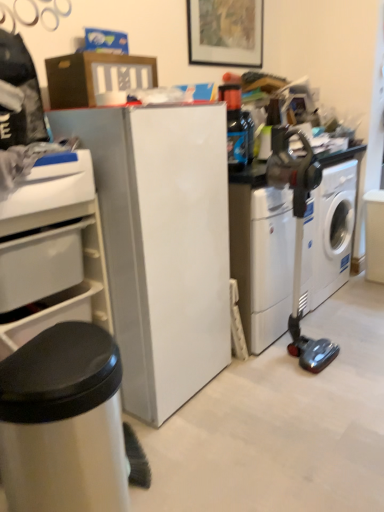
Question: From the image's perspective, relative to translucent plastic bottle at upper center, is white glossy washing machine at right, positioned as the first washing machine in right-to-left order, above or below?

Choices:
 (A) above
 (B) below

Answer: (B)

Question: Is point (322, 194) positioned closer to the camera than point (241, 124)?

Choices:
 (A) farther
 (B) closer

Answer: (A)

Question: Estimate the real-world distances between objects in this image. Which object is farther from the white plastic drawer at left?

Choices:
 (A) silver metallic trash can at lower left
 (B) metallic gray vacuum cleaner at right
 (C) white glossy washing machine at right, positioned as the first washing machine in right-to-left order
 (D) white glossy refrigerator at center
 (E) translucent plastic bottle at upper center

Answer: (C)

Question: Which object is the farthest from the silver metallic trash can at lower left?

Choices:
 (A) white plastic washing machine at center-right, placed as the second washing machine when sorted from right to left
 (B) white plastic drawer at left
 (C) translucent plastic bottle at upper center
 (D) metallic gray vacuum cleaner at right
 (E) white glossy refrigerator at center

Answer: (D)